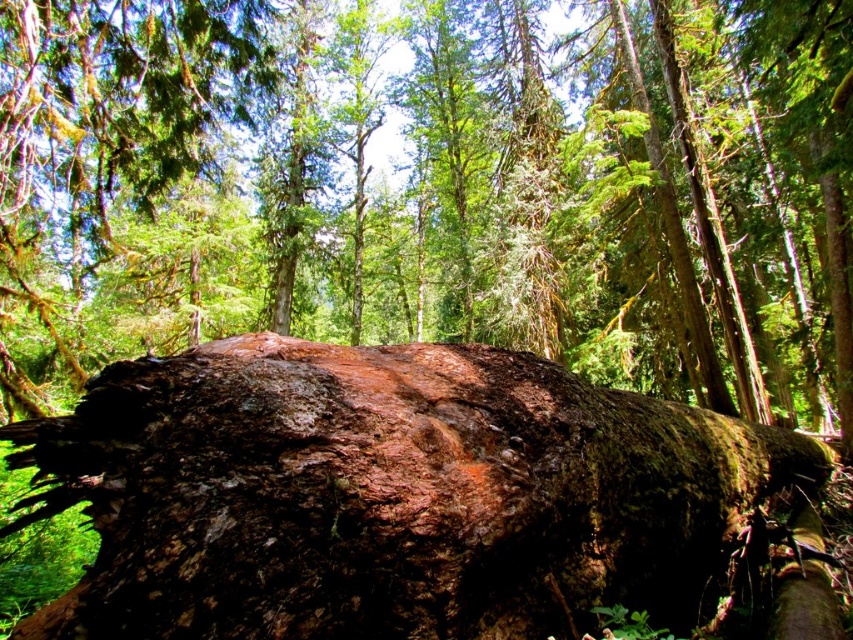
You are a hiker who wants to place a 10 meter long tent between the rough bark tree trunk at center and the rusty metallic boulder at center. Is there enough space between them to fit the tent?

The rough bark tree trunk at center is 10.16 meters away from the rusty metallic boulder at center, so yes, the tent can be placed between them since the distance is slightly more than the tent length.